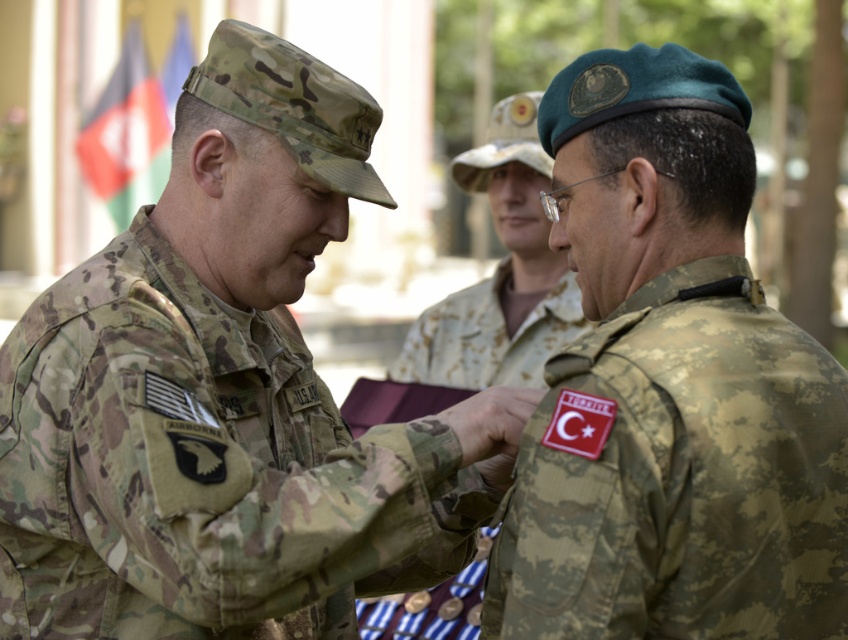
Between camo uniform at center and camouflage fabric beret at upper right, which one is positioned higher?

camouflage fabric beret at upper right

Where is `camo uniform at center`? The image size is (848, 640). camo uniform at center is located at coordinates (226, 396).